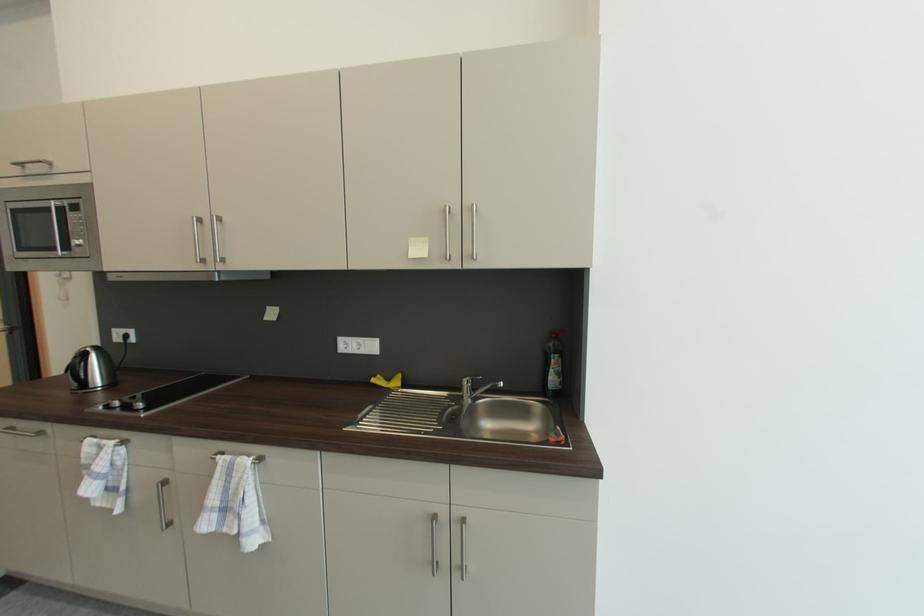
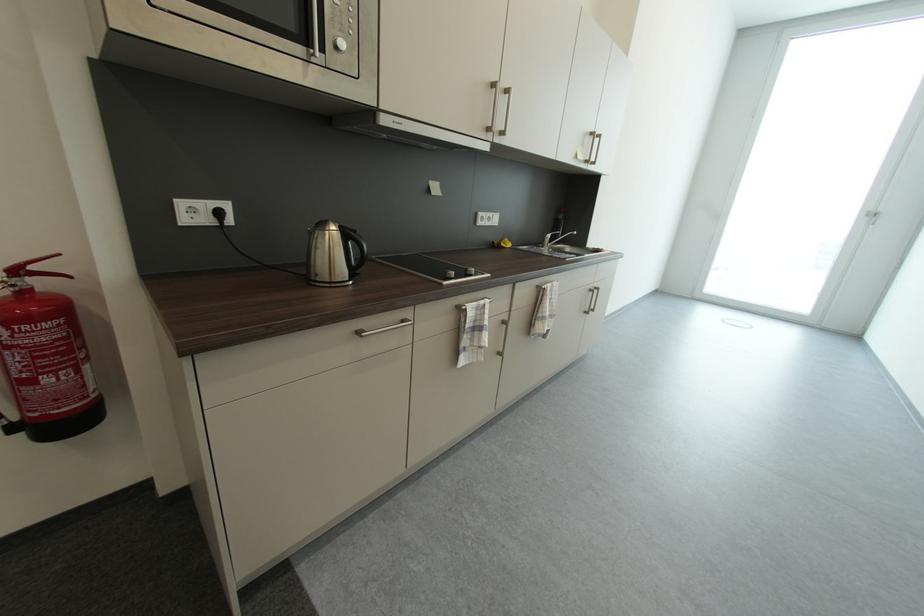
Where in the second image is the point corresponding to the point at 123,405 from the first image?

(458, 275)